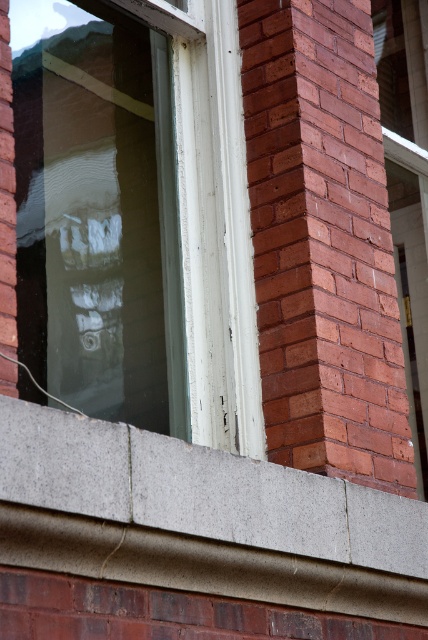
The width and height of the screenshot is (428, 640). What do you see at coordinates (134, 218) in the screenshot?
I see `white painted wood window at center` at bounding box center [134, 218].

Does white painted wood window at center have a larger size compared to smooth concrete ledge at lower center?

Correct, white painted wood window at center is larger in size than smooth concrete ledge at lower center.

Based on the photo, who is more distant from viewer, (x=130, y=10) or (x=41, y=496)?

Positioned behind is point (x=130, y=10).

You are a GUI agent. You are given a task and a screenshot of the screen. Output one action in this format:
    pyautogui.click(x=<x>, y=<y>)
    Task: Click on the white painted wood window at center
    This screenshot has height=640, width=428.
    Given the screenshot: What is the action you would take?
    pyautogui.click(x=134, y=218)